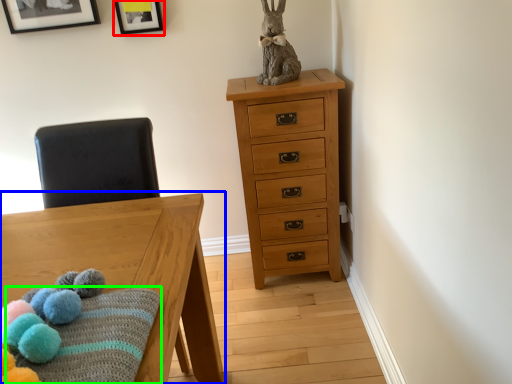
Question: Which object is positioned farthest from picture frame (highlighted by a red box)? Select from table (highlighted by a blue box) and blanket (highlighted by a green box).

Choices:
 (A) table
 (B) blanket

Answer: (B)